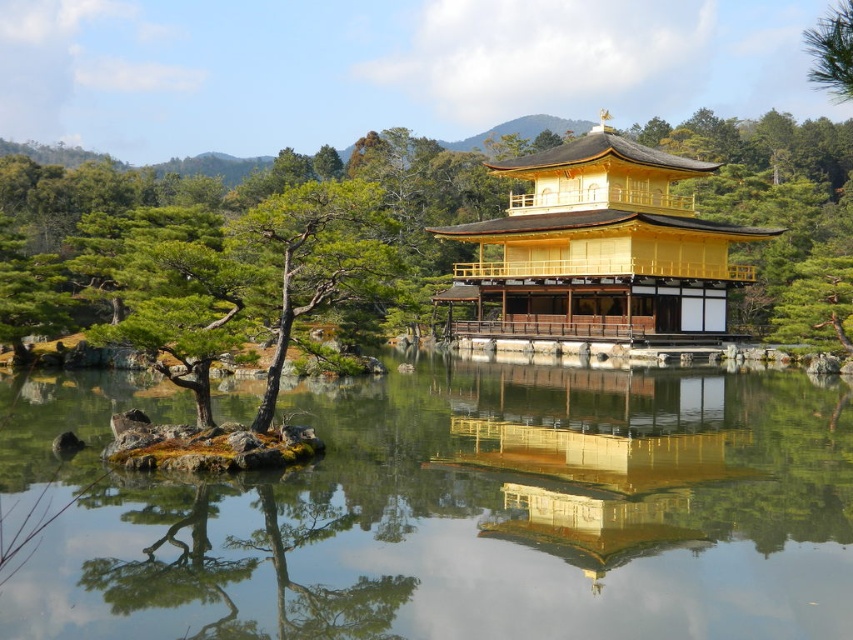
Is point (757, 228) closer to camera compared to point (828, 65)?

No, (757, 228) is behind (828, 65).

Which of these two, golden polished wood palace at center or green textured pine tree at upper right, stands shorter?

Standing shorter between the two is golden polished wood palace at center.

Does point (569, 324) come in front of point (850, 38)?

No, (569, 324) is behind (850, 38).

The width and height of the screenshot is (853, 640). What are the coordinates of `golden polished wood palace at center` in the screenshot? It's located at [x=601, y=250].

Does smooth brown bark tree at center appear on the right side of green textured pine tree at upper right?

Incorrect, smooth brown bark tree at center is not on the right side of green textured pine tree at upper right.

Is smooth brown bark tree at center behind green textured pine tree at upper right?

Yes, it is behind green textured pine tree at upper right.

Is point (349, 269) positioned before point (845, 88)?

No, it is not.

Locate an element on the screen. smooth brown bark tree at center is located at coordinates (317, 256).

Can you confirm if transparent water at center is positioned below gold reflective surface at center?

No, transparent water at center is not below gold reflective surface at center.

Does point (331, 534) come closer to viewer compared to point (624, 541)?

Yes.

Identify the location of transparent water at center. The height and width of the screenshot is (640, 853). (482, 516).